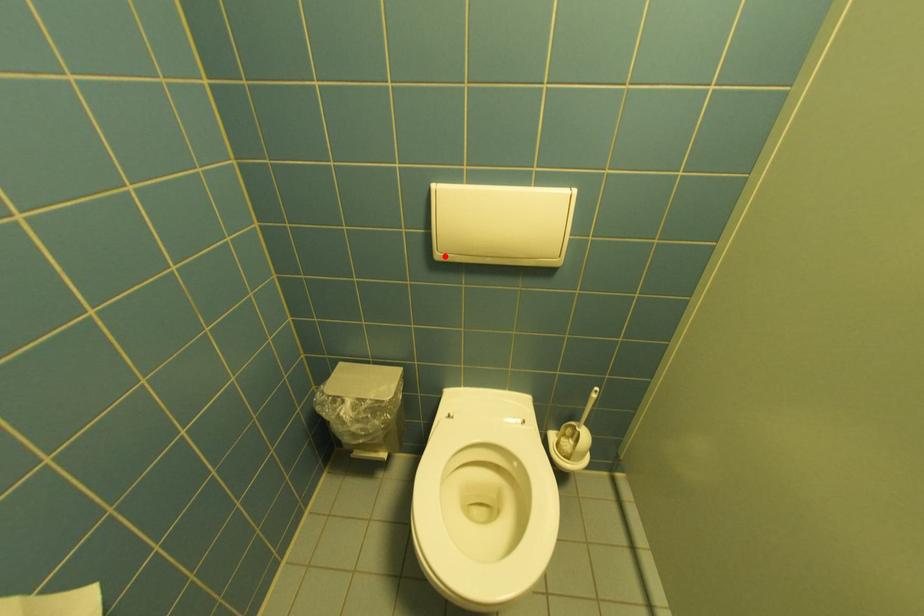
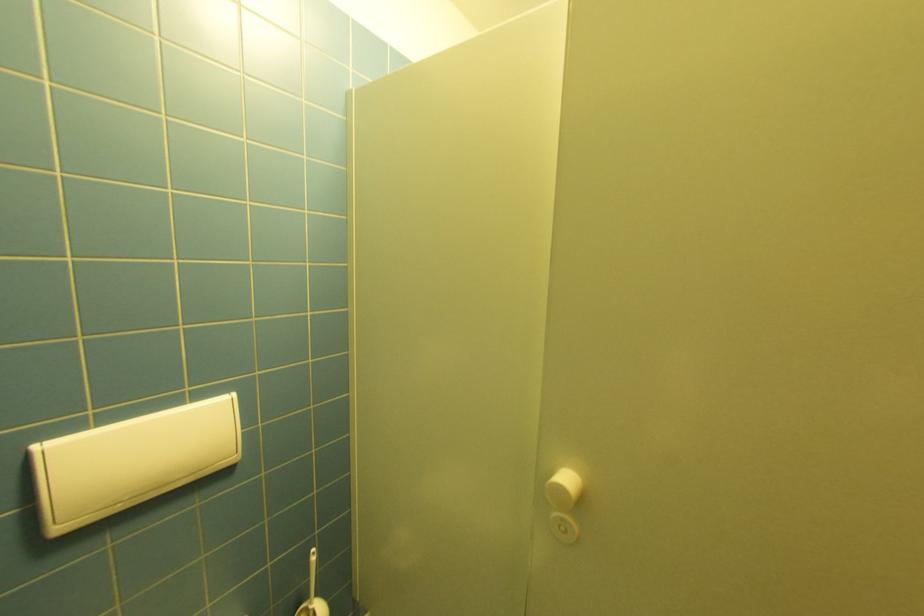
Question: I am providing you with two images of the same scene from different viewpoints. Image1 has a red point marked. In image2, the corresponding 3D location appears at what relative position? Reply with the corresponding letter.

Choices:
 (A) Closer
 (B) Farther

Answer: (A)